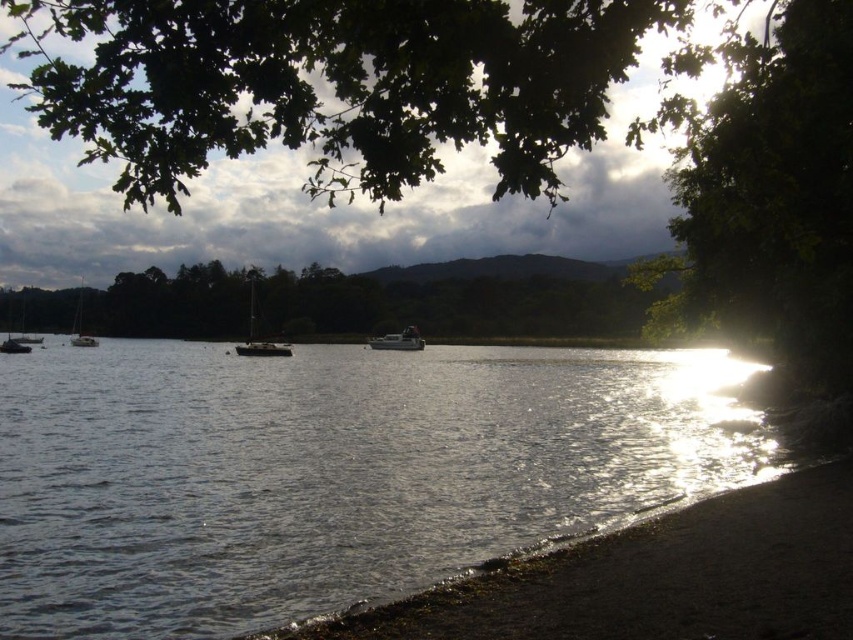
Based on the coordinates provided for the green leafy branches at upper center, can you determine their position relative to the center of the image?

The green leafy branches at upper center are located at coordinates approximately 0.133 on the x axis and 0.392 on the y axis, which places them slightly to the left and above the center of the image.

You are an artist planning to paint the lakeside scene. You want to ensure the green leafy tree at upper right and the white glossy sailboat at left are proportionally accurate. Which object should you draw wider in your painting?

The green leafy tree at upper right should be drawn wider in the painting since its width is larger than the white glossy sailboat at left.

You are standing on the lakeside and want to take a photo of both the green leafy tree at upper right and the metallic silver sailboat at left. Which object should you position on the right side of your camera frame to include both in the photo?

To include both the green leafy tree at upper right and the metallic silver sailboat at left in your photo, position the green leafy tree at upper right on the right side of your camera frame since it is located to the right of the metallic silver sailboat at left.